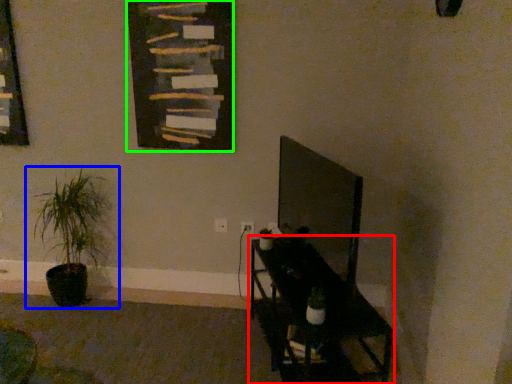
Question: Which is farther away from furniture (highlighted by a red box)? houseplant (highlighted by a blue box) or bulletin board (highlighted by a green box)?

Choices:
 (A) houseplant
 (B) bulletin board

Answer: (A)